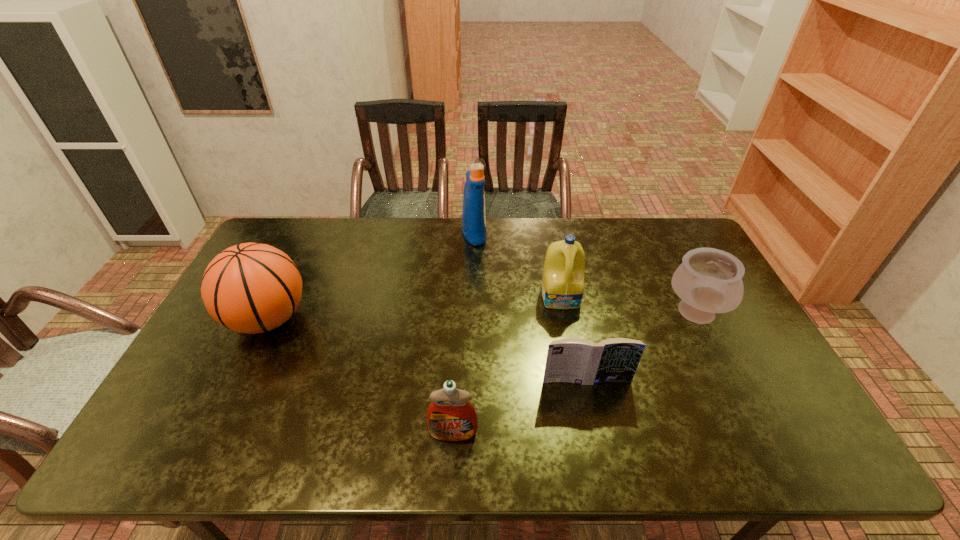
Find the location of a particular element. The height and width of the screenshot is (540, 960). free space between the rightmost detergent and the shortest detergent is located at coordinates (507, 365).

The width and height of the screenshot is (960, 540). Identify the location of the closest object to the second nearest detergent. (709, 281).

Image resolution: width=960 pixels, height=540 pixels. What are the coordinates of `object that is the fourth closest to the book` in the screenshot? It's located at (473, 213).

I want to click on detergent that is the closest to the farthest detergent, so click(x=563, y=276).

This screenshot has height=540, width=960. Identify the location of detergent that can be found as the third closest to the leftmost object. (563, 276).